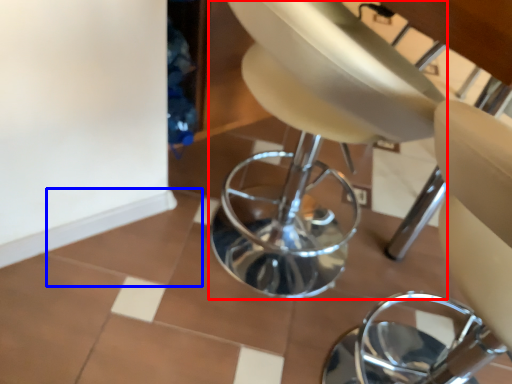
Question: Which point is closer to the camera, swivel chair (highlighted by a red box) or ceramic tile (highlighted by a blue box)?

Choices:
 (A) swivel chair
 (B) ceramic tile

Answer: (A)